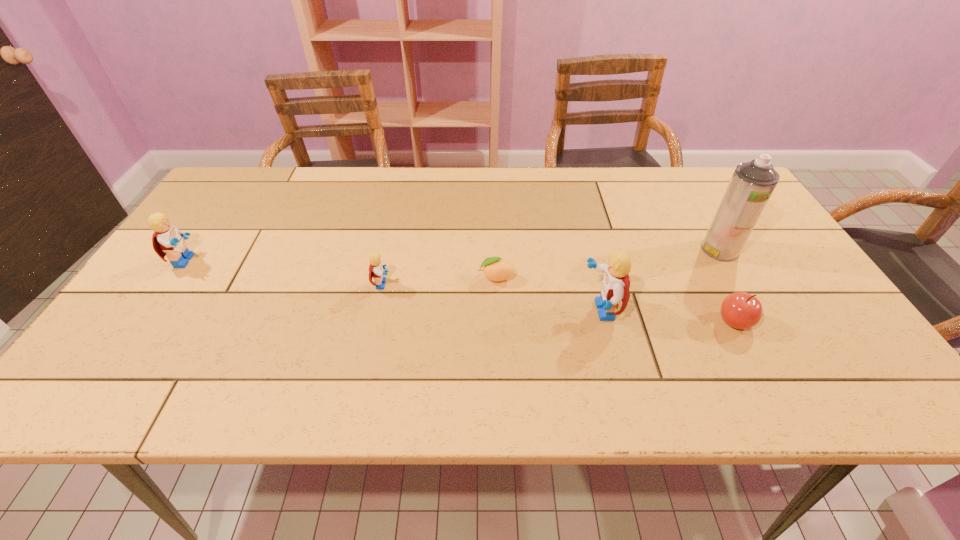
You are a GUI agent. You are given a task and a screenshot of the screen. Output one action in this format:
    pyautogui.click(x=<x>, y=<y>)
    Task: Click on the free point that keeps the Legos evenly spaced on the right
    The height and width of the screenshot is (540, 960).
    Given the screenshot: What is the action you would take?
    pyautogui.click(x=848, y=340)